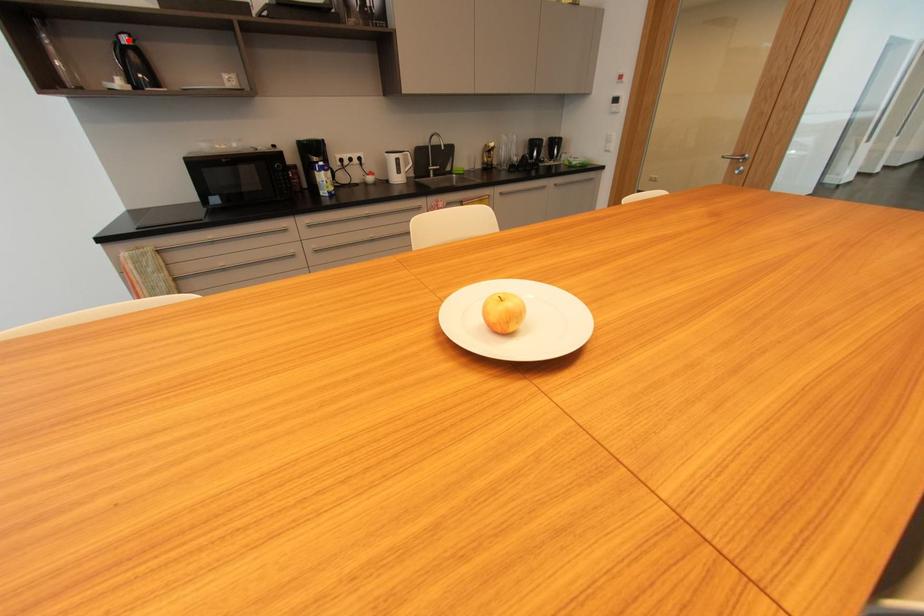
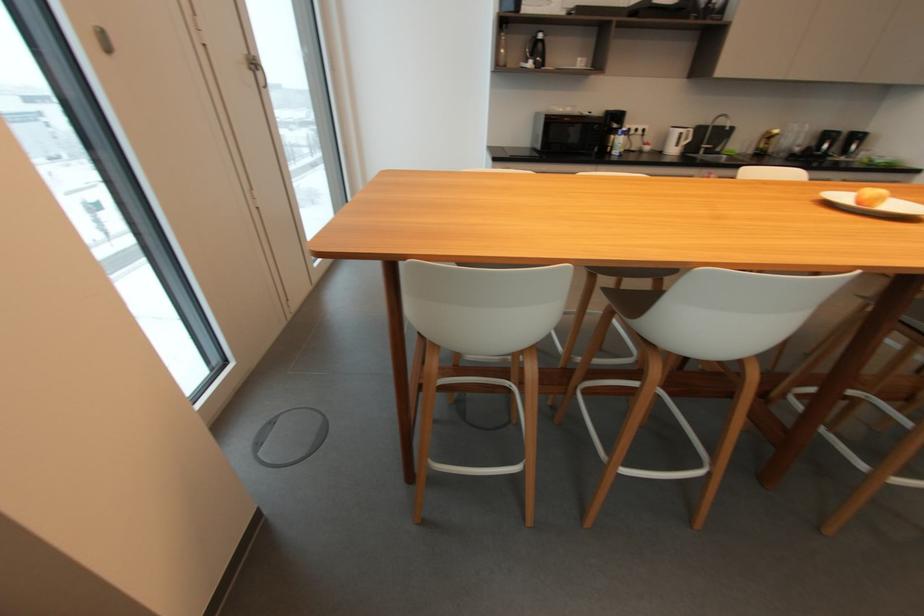
Locate, in the second image, the point that corresponds to the highlighted location in the first image.

(544, 36)